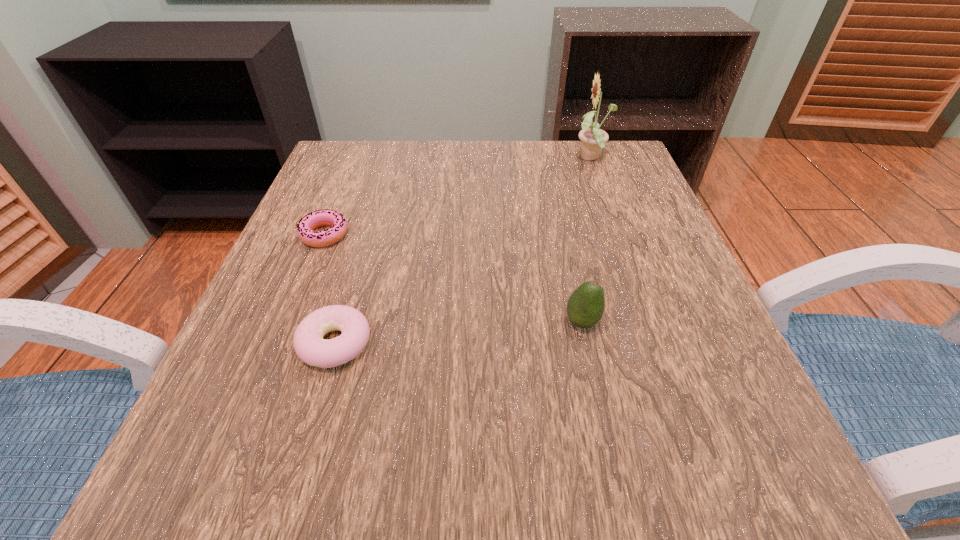
Identify the location of sunflower. The image size is (960, 540). (592, 139).

Identify the location of the rightmost object. (592, 139).

At what (x,y) coordinates should I click in order to perform the action: click on the third shortest object. Please return your answer as a coordinate pair (x, y). The height and width of the screenshot is (540, 960). Looking at the image, I should click on (585, 307).

Where is `avocado`? Image resolution: width=960 pixels, height=540 pixels. avocado is located at coordinates (585, 307).

You are a GUI agent. You are given a task and a screenshot of the screen. Output one action in this format:
    pyautogui.click(x=<x>, y=<y>)
    Task: Click on the third tallest object
    This screenshot has height=540, width=960.
    Given the screenshot: What is the action you would take?
    pyautogui.click(x=309, y=345)

This screenshot has height=540, width=960. I want to click on the taller doughnut, so click(309, 345).

Identify the location of the shortest object. (326, 217).

Identify the location of the farther doughnut. (326, 217).

Find the location of a particular element. The image size is (960, 540). vacant region located 0.330m on the front-facing side of the rightmost object is located at coordinates (437, 159).

Identify the location of vacant space located on the front-facing side of the rightmost object. (490, 159).